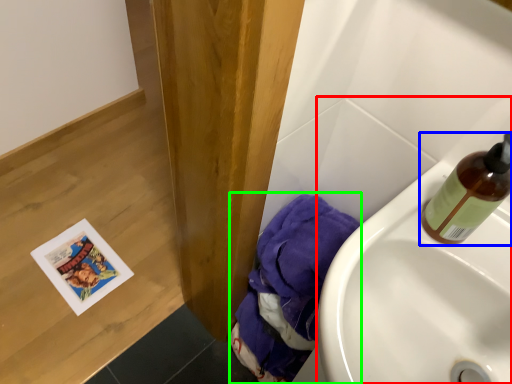
Question: Which object is positioned closest to sink (highlighted by a red box)? Select from bottle (highlighted by a blue box) and material (highlighted by a green box).

Choices:
 (A) bottle
 (B) material

Answer: (A)